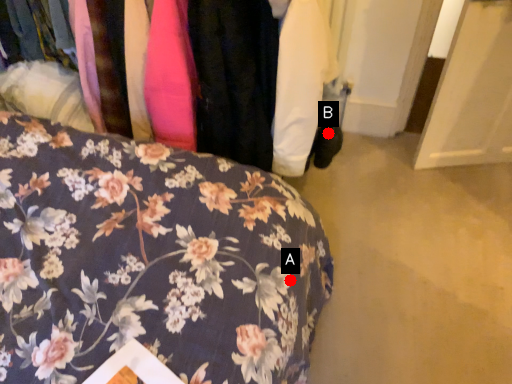
Question: Two points are circled on the image, labeled by A and B beside each circle. Which point is closer to the camera taking this photo?

Choices:
 (A) A is closer
 (B) B is closer

Answer: (A)